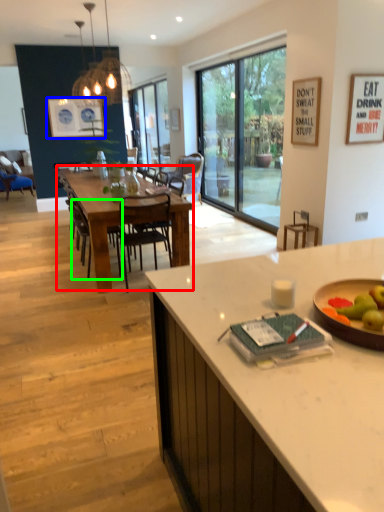
Question: Considering the real-world distances, which object is closest to kitchen & dining room table (highlighted by a red box)? painting (highlighted by a blue box) or chair (highlighted by a green box).

Choices:
 (A) painting
 (B) chair

Answer: (B)